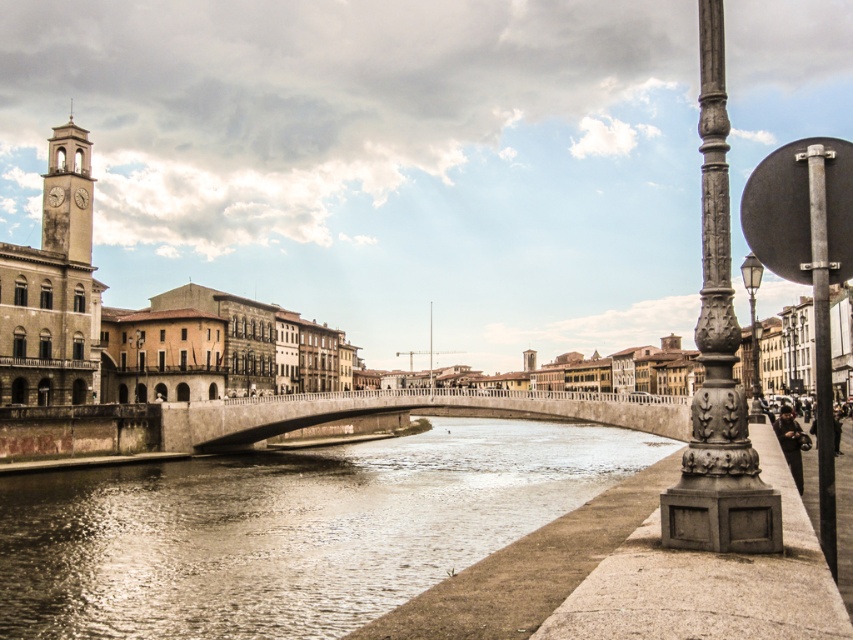
You are a city planner evaluating the urban layout. Based on the scene, which object is shorter between the smooth stone bridge at center and the stone clock tower at upper left?

The smooth stone bridge at center is shorter than the stone clock tower at upper left.

You are standing at the origin point of the image coordinate system. You want to walk to the smooth stone bridge at center. In which direction should you move relative to your current position?

The smooth stone bridge at center is located at coordinates point (409, 412). Since the coordinate system places the origin at the bottom left corner, moving towards the right and slightly upwards would lead you to the smooth stone bridge at center.